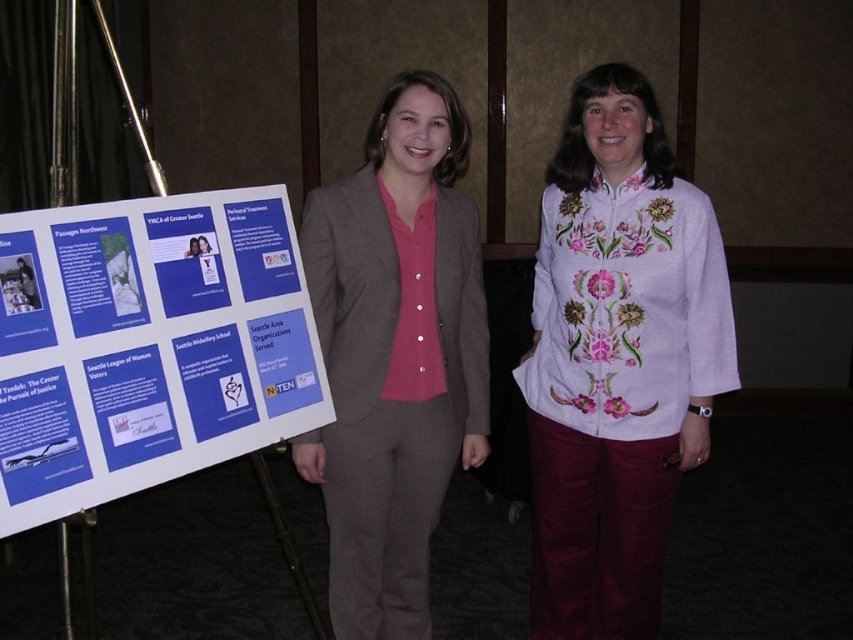
Question: Can you confirm if blue paper poster at left is bigger than matte gray suit at center?

Choices:
 (A) no
 (B) yes

Answer: (A)

Question: Which object is the closest to the white embroidered blouse at center?

Choices:
 (A) matte gray suit at center
 (B) blue paper poster at left

Answer: (A)

Question: Among these points, which one is farthest from the camera?

Choices:
 (A) [419, 278]
 (B) [614, 401]
 (C) [143, 353]

Answer: (B)

Question: In this image, where is white embroidered blouse at center located relative to matte gray suit at center?

Choices:
 (A) above
 (B) below

Answer: (B)

Question: Which of the following is the farthest from the observer?

Choices:
 (A) matte gray suit at center
 (B) blue paper poster at left
 (C) white embroidered blouse at center

Answer: (C)

Question: Is white embroidered blouse at center smaller than matte gray suit at center?

Choices:
 (A) no
 (B) yes

Answer: (A)